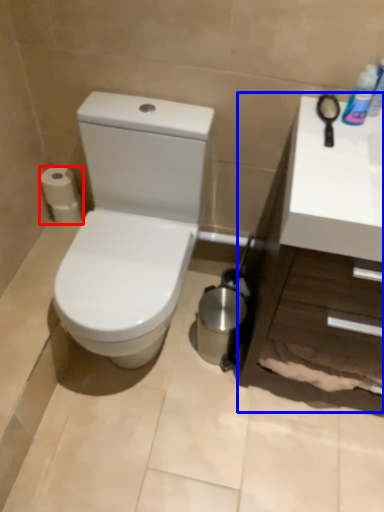
Question: Which of the following is the farthest to the observer, toilet paper (highlighted by a red box) or counter top (highlighted by a blue box)?

Choices:
 (A) toilet paper
 (B) counter top

Answer: (A)